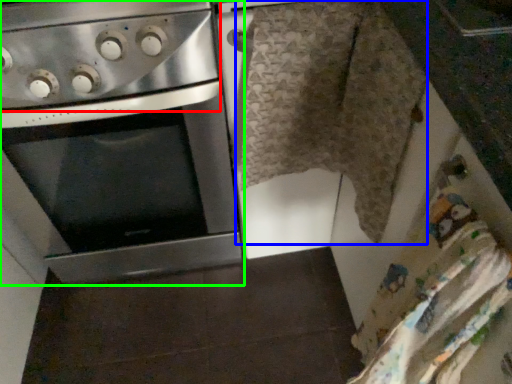
Question: Estimate the real-world distances between objects in this image. Which object is farther from gas stove (highlighted by a red box), blanket (highlighted by a blue box) or oven (highlighted by a green box)?

Choices:
 (A) blanket
 (B) oven

Answer: (A)